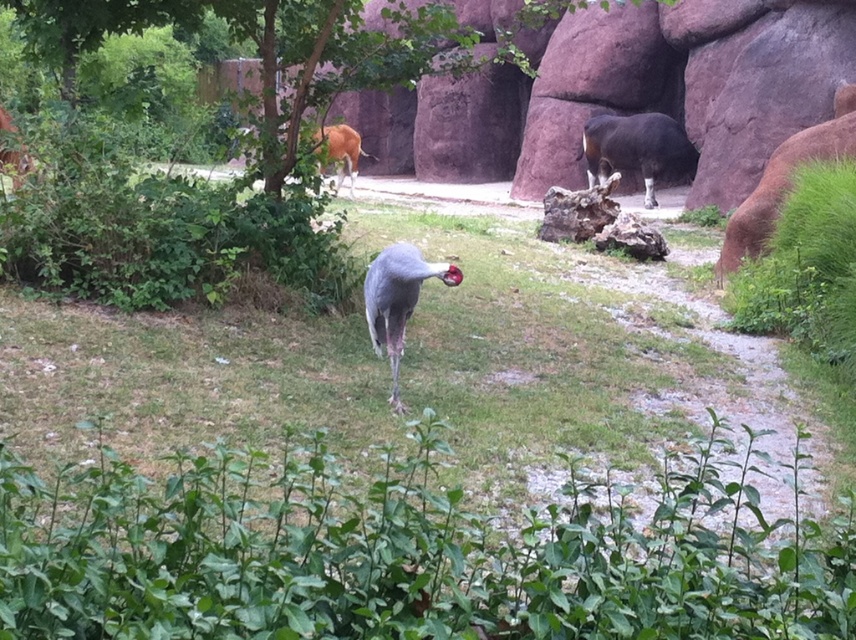
Question: Which point is closer to the camera?

Choices:
 (A) (354, 193)
 (B) (94, 20)
 (C) (589, 161)
 (D) (428, 275)

Answer: (D)

Question: Which point appears farthest from the camera in this image?

Choices:
 (A) (375, 280)
 (B) (337, 163)

Answer: (B)

Question: Among these points, which one is nearest to the camera?

Choices:
 (A) (391, 371)
 (B) (317, 168)
 (C) (675, 156)
 (D) (419, 33)

Answer: (A)

Question: Is green leafy tree at upper center smaller than gray matte bird at center?

Choices:
 (A) no
 (B) yes

Answer: (A)

Question: In this image, where is shiny black cow at center located relative to brown glossy antelope at upper center?

Choices:
 (A) right
 (B) left

Answer: (A)

Question: Is shiny black cow at center further to the viewer compared to gray matte bird at center?

Choices:
 (A) no
 (B) yes

Answer: (B)